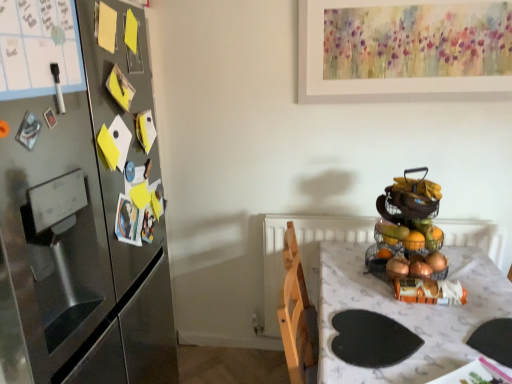
Question: Could you tell me if wire mesh fruit basket at right, acting as the first basket starting from the top, is turned towards wire mesh basket at right, the 2th basket when ordered from top to bottom?

Choices:
 (A) yes
 (B) no

Answer: (B)

Question: From a real-world perspective, is wire mesh fruit basket at right, the second basket from the bottom, located higher than wire mesh basket at right, which appears as the first basket when ordered from the bottom?

Choices:
 (A) no
 (B) yes

Answer: (B)

Question: Is wire mesh fruit basket at right, acting as the first basket starting from the top, surrounding wire mesh basket at right, the 2th basket when ordered from top to bottom?

Choices:
 (A) no
 (B) yes

Answer: (A)

Question: From the image's perspective, is wire mesh fruit basket at right, acting as the first basket starting from the top, beneath wire mesh basket at right, which appears as the first basket when ordered from the bottom?

Choices:
 (A) yes
 (B) no

Answer: (B)

Question: Is wire mesh fruit basket at right, acting as the first basket starting from the top, in front of wire mesh basket at right, which appears as the first basket when ordered from the bottom?

Choices:
 (A) no
 (B) yes

Answer: (B)

Question: Is wire mesh fruit basket at right, acting as the first basket starting from the top, with wire mesh basket at right, the 2th basket when ordered from top to bottom?

Choices:
 (A) yes
 (B) no

Answer: (B)

Question: From a real-world perspective, is white glossy table at center physically above wire mesh fruit basket at right, the second basket from the bottom?

Choices:
 (A) yes
 (B) no

Answer: (B)

Question: Can you confirm if white glossy table at center is thinner than wire mesh fruit basket at right, the second basket from the bottom?

Choices:
 (A) no
 (B) yes

Answer: (A)

Question: Considering the relative sizes of white glossy table at center and wire mesh fruit basket at right, the second basket from the bottom, in the image provided, is white glossy table at center smaller than wire mesh fruit basket at right, the second basket from the bottom,?

Choices:
 (A) yes
 (B) no

Answer: (B)

Question: Does white glossy table at center lie behind wire mesh fruit basket at right, the second basket from the bottom?

Choices:
 (A) no
 (B) yes

Answer: (A)

Question: From the image's perspective, is white glossy table at center beneath wire mesh fruit basket at right, the second basket from the bottom?

Choices:
 (A) yes
 (B) no

Answer: (A)

Question: From the image's perspective, is white glossy table at center above wire mesh fruit basket at right, acting as the first basket starting from the top?

Choices:
 (A) yes
 (B) no

Answer: (B)

Question: Is stainless steel refrigerator at left shorter than white glossy table at center?

Choices:
 (A) yes
 (B) no

Answer: (B)